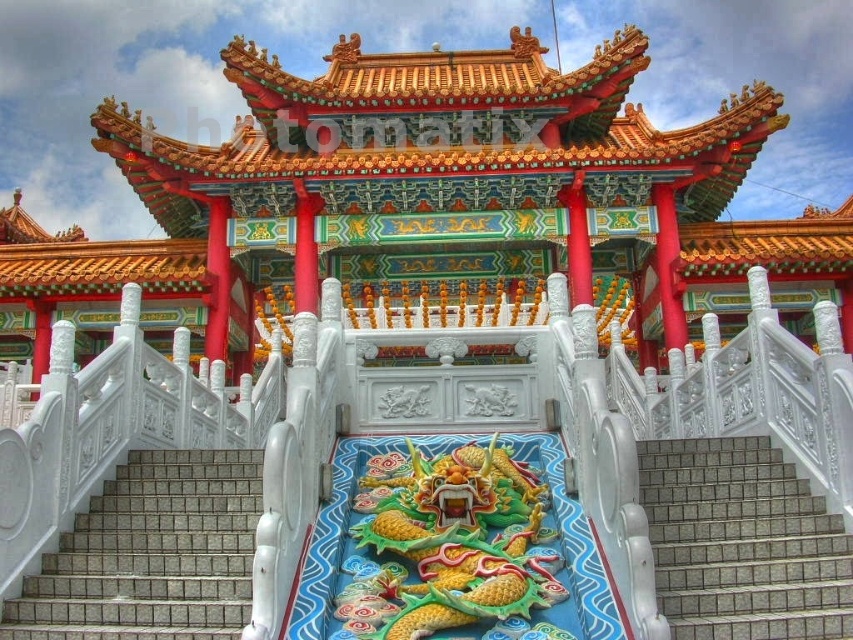
You are a tourist standing at the base of the pavilion and want to ascend the stairs. You see the white tile stairs at center and the gray tile stairs at center. Which set of stairs should you use to reach the entrance?

You should use the white tile stairs at center because it is positioned under the gray tile stairs at center, meaning it leads directly to the entrance.

You are standing at the base of the pavilion and want to take a photo of the dragon sculpture. The dragon sculpture is located at point (56, 560). If your camera has a maximum focus range of 100 feet, will you need to move closer to capture a clear image?

The point (56, 560) is 111.10 feet from the viewer. Since the camera can only focus up to 100 feet, you need to move closer to ensure the dragon sculpture is within the focus range.